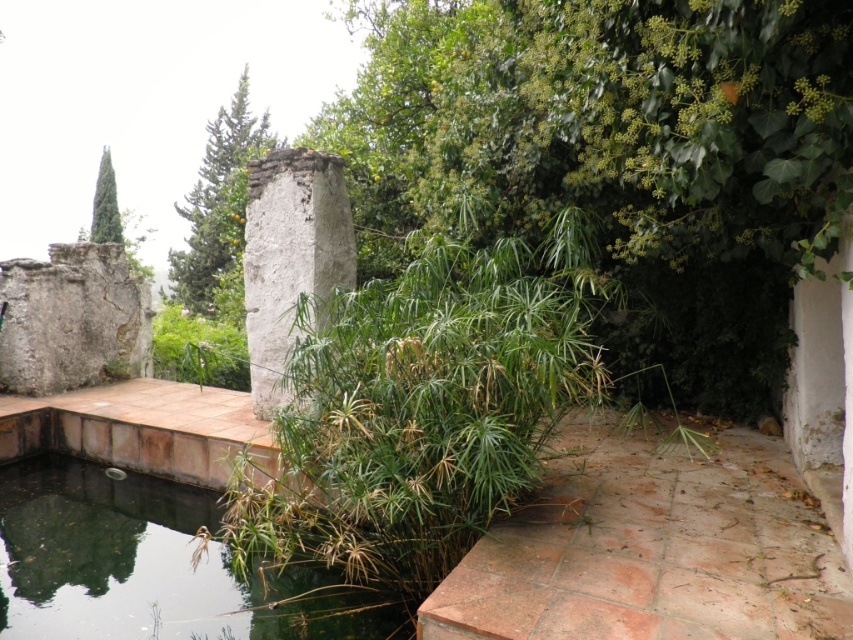
Question: Can you confirm if transparent water at center is positioned below white rough stone pillar at center?

Choices:
 (A) no
 (B) yes

Answer: (B)

Question: Does transparent water at center have a smaller size compared to white rough stone pillar at center?

Choices:
 (A) no
 (B) yes

Answer: (A)

Question: Can you confirm if transparent water at center is positioned above white rough stone pillar at center?

Choices:
 (A) no
 (B) yes

Answer: (A)

Question: Which point is closer to the camera?

Choices:
 (A) white rough stone pillar at center
 (B) transparent water at center

Answer: (B)